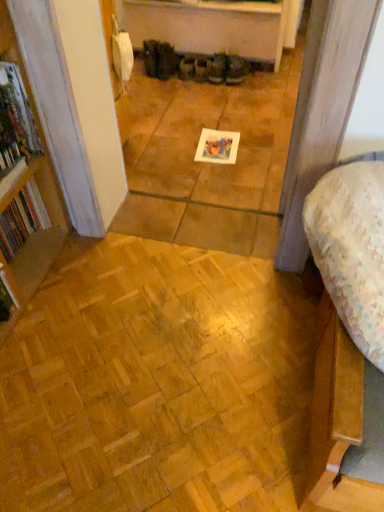
Question: From the image's perspective, is floral fabric bed at lower right above hardcover book at left, which ranks as the second book in back-to-front order?

Choices:
 (A) yes
 (B) no

Answer: (B)

Question: Does floral fabric bed at lower right lie behind hardcover book at left, arranged as the first book when viewed from the front?

Choices:
 (A) yes
 (B) no

Answer: (B)

Question: Does floral fabric bed at lower right have a greater width compared to hardcover book at left, which ranks as the second book in back-to-front order?

Choices:
 (A) no
 (B) yes

Answer: (B)

Question: Is floral fabric bed at lower right touching hardcover book at left, arranged as the first book when viewed from the front?

Choices:
 (A) yes
 (B) no

Answer: (B)

Question: Is floral fabric bed at lower right completely or partially outside of hardcover book at left, arranged as the first book when viewed from the front?

Choices:
 (A) yes
 (B) no

Answer: (A)

Question: In the image, is hardcover book at left, which is the first book in back-to-front order, on the left side or the right side of natural wood parquet floor at lower left?

Choices:
 (A) left
 (B) right

Answer: (A)

Question: Is point (18, 216) closer or farther from the camera than point (125, 362)?

Choices:
 (A) farther
 (B) closer

Answer: (A)

Question: From their relative heights in the image, would you say hardcover book at left, which is the first book in back-to-front order, is taller or shorter than natural wood parquet floor at lower left?

Choices:
 (A) short
 (B) tall

Answer: (B)

Question: Based on their sizes in the image, would you say hardcover book at left, which is the first book in back-to-front order, is bigger or smaller than natural wood parquet floor at lower left?

Choices:
 (A) big
 (B) small

Answer: (B)

Question: From the image's perspective, is matte brown boot at center above or below natural wood parquet floor at lower left?

Choices:
 (A) below
 (B) above

Answer: (B)

Question: Looking at their shapes, would you say matte brown boot at center is wider or thinner than natural wood parquet floor at lower left?

Choices:
 (A) thin
 (B) wide

Answer: (A)

Question: From a real-world perspective, is matte brown boot at center positioned above or below natural wood parquet floor at lower left?

Choices:
 (A) above
 (B) below

Answer: (A)

Question: In the image, is matte brown boot at center on the left side or the right side of natural wood parquet floor at lower left?

Choices:
 (A) right
 (B) left

Answer: (A)

Question: Based on their sizes in the image, would you say hardcover book at left, which is the first book in back-to-front order, is bigger or smaller than matte brown boot at center?

Choices:
 (A) small
 (B) big

Answer: (B)

Question: From a real-world perspective, is hardcover book at left, which is the first book in back-to-front order, physically located above or below matte brown boot at center?

Choices:
 (A) above
 (B) below

Answer: (A)